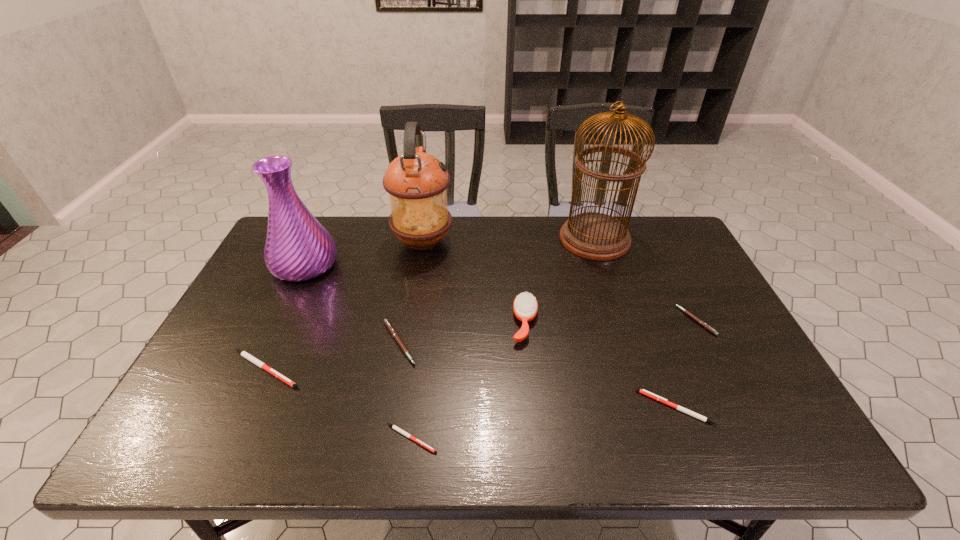
Find the location of `birdcage`. birdcage is located at coordinates (595, 236).

You are a GUI agent. You are given a task and a screenshot of the screen. Output one action in this format:
    pyautogui.click(x=<x>, y=<y>)
    Task: Click on the oil lamp
    The image size is (960, 540).
    Given the screenshot: What is the action you would take?
    pyautogui.click(x=417, y=182)

Find the location of a particular element. purple vase is located at coordinates (298, 248).

You are a GUI agent. You are given a task and a screenshot of the screen. Output one action in this format:
    pyautogui.click(x=<x>, y=<y>)
    Task: Click on the third tallest object
    Image resolution: width=960 pixels, height=540 pixels.
    Given the screenshot: What is the action you would take?
    pyautogui.click(x=298, y=248)

Where is `the fourth object from right to left`? The width and height of the screenshot is (960, 540). the fourth object from right to left is located at coordinates (525, 306).

Find the location of a particular element. Image resolution: width=960 pixels, height=540 pixels. the fourth tallest object is located at coordinates (525, 306).

Find the location of a particular element. Image resolution: width=960 pixels, height=540 pixels. the left pink pen is located at coordinates (388, 324).

You are a GUI agent. You are given a task and a screenshot of the screen. Output one action in this format:
    pyautogui.click(x=<x>, y=<y>)
    Task: Click on the farthest white pen
    The image size is (960, 540).
    Given the screenshot: What is the action you would take?
    pyautogui.click(x=246, y=355)

You are a GUI agent. You are given a task and a screenshot of the screen. Output one action in this format:
    pyautogui.click(x=<x>, y=<y>)
    Task: Click on the leftmost pen
    The image size is (960, 540).
    Given the screenshot: What is the action you would take?
    pyautogui.click(x=246, y=355)

The image size is (960, 540). I want to click on the rightmost object, so click(x=702, y=323).